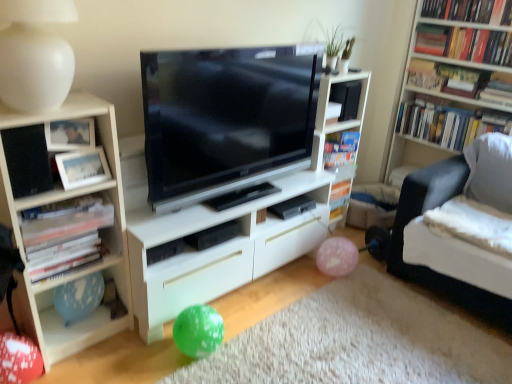
Question: Is black matte paperback book at center inside or outside of black matte speaker at upper right, which is the 2th speaker in front-to-back order?

Choices:
 (A) outside
 (B) inside

Answer: (A)

Question: Does point (287, 200) appear closer or farther from the camera than point (348, 99)?

Choices:
 (A) farther
 (B) closer

Answer: (B)

Question: Estimate the real-world distances between objects in this image. Which object is closer to the white matte bookshelf at left, acting as the fifth book starting from the right?

Choices:
 (A) hardcover book at upper right, arranged as the 1th book when viewed from the right
 (B) hardcover book at upper right, which appears as the 2th book when ordered from the bottom
 (C) black matte paperback book at center
 (D) matte white picture frame at upper left, the 1th picture frame from the top
 (E) hardcover books at upper right, acting as the 3th book starting from the bottom

Answer: (D)

Question: Based on their relative distances, which object is nearer to the black matte speaker at upper right, which ranks as the second speaker in bottom-to-top order?

Choices:
 (A) red dotted balloon at lower left, which is counted as the first balloon, starting from the front
 (B) white matte shelf at center, which is the 2th shelf in left-to-right order
 (C) white wood bookshelf at upper right, the third shelf from the left
 (D) matte white picture frame at upper left, the 1th picture frame from the top
 (E) hardcover book at upper right, which ranks as the fourth book in top-to-bottom order

Answer: (B)